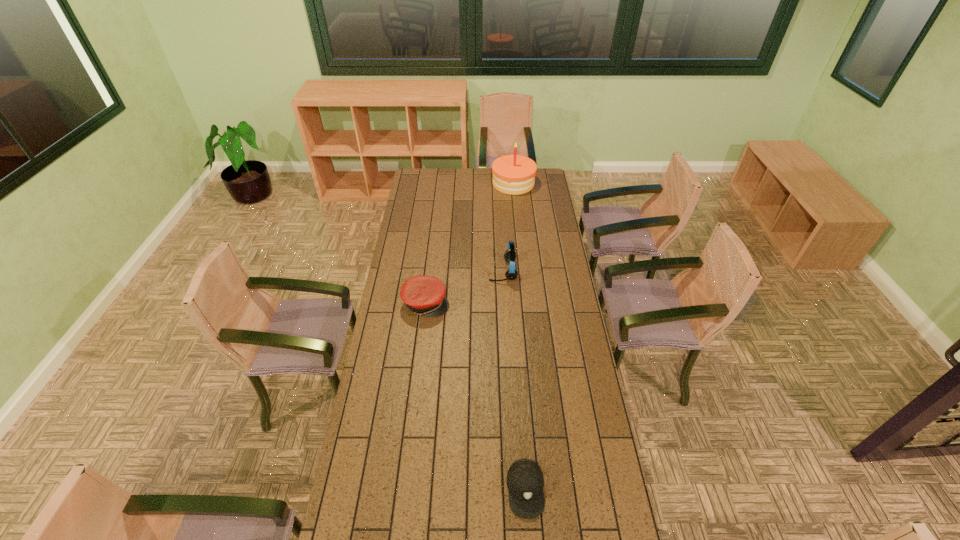
Locate an element on the screen. free region located 0.130m with the microphone attached to the side of the third shortest object is located at coordinates (463, 271).

You are a GUI agent. You are given a task and a screenshot of the screen. Output one action in this format:
    pyautogui.click(x=<x>, y=<y>)
    Task: Click on the vacant region located 0.220m with the microphone attached to the side of the third shortest object
    This screenshot has height=540, width=960.
    Given the screenshot: What is the action you would take?
    pyautogui.click(x=445, y=271)

Identify the location of vacant region located 0.220m on the front of the left cap with an emblem. This screenshot has width=960, height=540. (496, 303).

What are the coordinates of `object that is at the far edge` in the screenshot? It's located at (514, 174).

Locate an element on the screen. The width and height of the screenshot is (960, 540). object at the left edge is located at coordinates (425, 295).

You are a GUI agent. You are given a task and a screenshot of the screen. Output one action in this format:
    pyautogui.click(x=<x>, y=<y>)
    Task: Click on the object located in the right edge section of the desktop
    The image size is (960, 540).
    Given the screenshot: What is the action you would take?
    pyautogui.click(x=514, y=174)

This screenshot has height=540, width=960. Find the location of `object that is at the far right corner`. object that is at the far right corner is located at coordinates (514, 174).

Locate an element on the screen. This screenshot has height=540, width=960. free region at the far edge is located at coordinates (493, 186).

This screenshot has width=960, height=540. In the image, there is a desktop. Find the location of `vacant region at the left edge`. vacant region at the left edge is located at coordinates (405, 319).

At what (x,y) coordinates should I click in order to perform the action: click on vacant space at the right edge of the desktop. Please return your answer as a coordinate pair (x, y). The width and height of the screenshot is (960, 540). Looking at the image, I should click on (614, 486).